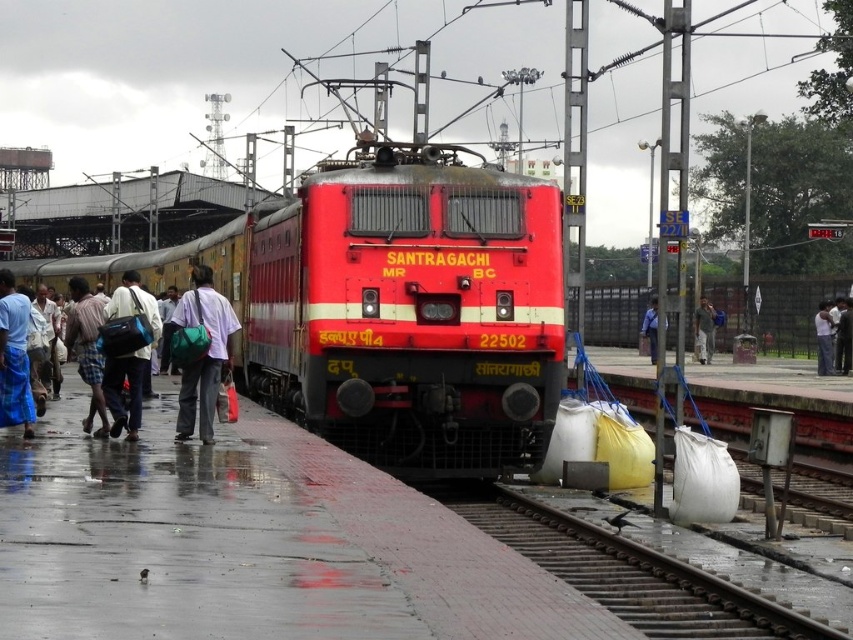
You are a passenger on the train platform looking for your luggage. You notice a blue fabric bag at left and a blue shirt at center. Which item is closer to the edge of the platform?

The blue fabric bag at left is closer to the edge of the platform since it is positioned to the left of the blue shirt at center, which is nearer to the center of the platform.

You are a passenger on the platform and see the blue fabric bag at left and the blue shirt at center. Which one is closer to you?

The blue fabric bag at left is closer to you because it is in front of the blue shirt at center.

You are standing at the edge of the platform in the railway station scene. You notice the metal train track at lower center. If you want to walk directly towards the track, which direction should you move in relation to your current position?

Since the metal train track at lower center is located at point coordinates, you should move forward towards the lower center direction to reach it.